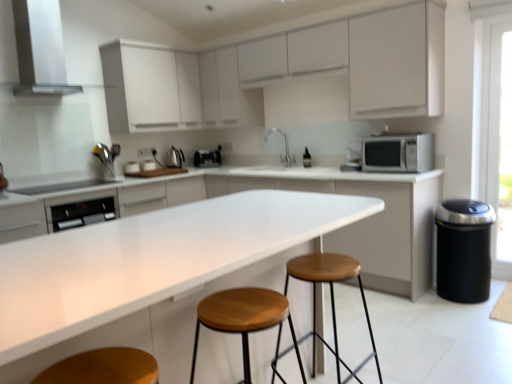
Image resolution: width=512 pixels, height=384 pixels. In order to click on free space above wooden/metallic stool at center, placed as the 1th stool when sorted from back to front (from a real-world perspective) in this screenshot , I will do `click(321, 265)`.